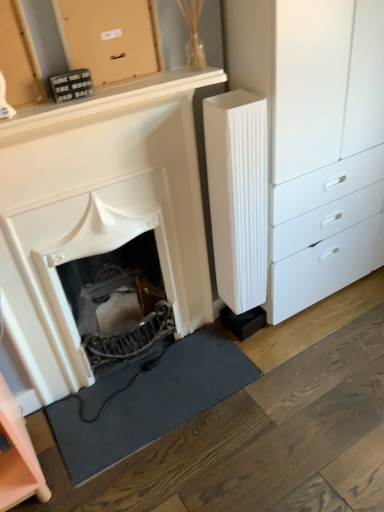
Where is `free spot to the right of white ribbed radiator at right`? free spot to the right of white ribbed radiator at right is located at coordinates (284, 333).